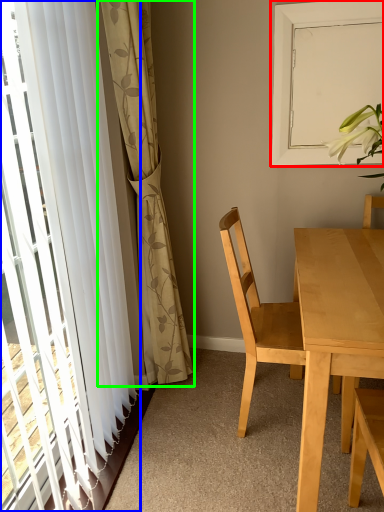
Question: Which object is positioned closest to window screen (highlighted by a red box)? Select from curtain (highlighted by a blue box) and curtain (highlighted by a green box).

Choices:
 (A) curtain
 (B) curtain

Answer: (B)